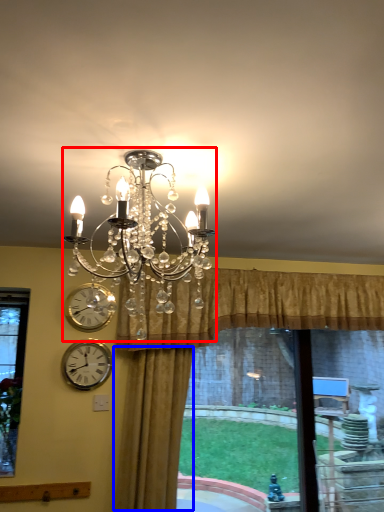
Question: Which of the following is the farthest to the observer, lamp (highlighted by a red box) or curtain (highlighted by a blue box)?

Choices:
 (A) lamp
 (B) curtain

Answer: (B)